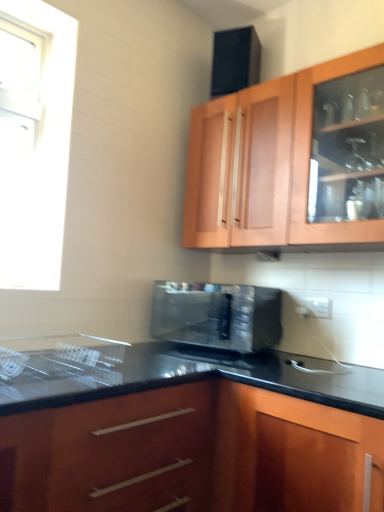
Question: Can you confirm if satin black microwave at center is thinner than glossy wood cabinet at lower center, the first cabinetry when ordered from bottom to top?

Choices:
 (A) no
 (B) yes

Answer: (B)

Question: Is satin black microwave at center at the left side of glossy wood cabinet at lower center, the first cabinetry when ordered from bottom to top?

Choices:
 (A) yes
 (B) no

Answer: (A)

Question: Considering the relative sizes of satin black microwave at center and glossy wood cabinet at lower center, the first cabinetry when ordered from bottom to top, in the image provided, is satin black microwave at center shorter than glossy wood cabinet at lower center, the first cabinetry when ordered from bottom to top,?

Choices:
 (A) yes
 (B) no

Answer: (A)

Question: Is the position of satin black microwave at center less distant than that of glossy wood cabinet at lower center, which is the 2th cabinetry from top to bottom?

Choices:
 (A) yes
 (B) no

Answer: (B)

Question: From a real-world perspective, does satin black microwave at center stand above glossy wood cabinet at lower center, which is the 2th cabinetry from top to bottom?

Choices:
 (A) yes
 (B) no

Answer: (A)

Question: Is glossy wood cabinet at lower center, which is the 2th cabinetry from top to bottom, in front of or behind satin black microwave at center in the image?

Choices:
 (A) front
 (B) behind

Answer: (A)

Question: From the image's perspective, is glossy wood cabinet at lower center, which is the 2th cabinetry from top to bottom, located above or below satin black microwave at center?

Choices:
 (A) above
 (B) below

Answer: (B)

Question: Considering the positions of glossy wood cabinet at lower center, the first cabinetry when ordered from bottom to top, and satin black microwave at center in the image, is glossy wood cabinet at lower center, the first cabinetry when ordered from bottom to top, taller or shorter than satin black microwave at center?

Choices:
 (A) short
 (B) tall

Answer: (B)

Question: Is glossy wood cabinet at lower center, which is the 2th cabinetry from top to bottom, inside the boundaries of satin black microwave at center, or outside?

Choices:
 (A) inside
 (B) outside

Answer: (B)

Question: In the image, is wooden cabinet at upper center, the first cabinetry when ordered from top to bottom, positioned in front of or behind white glossy window at upper left?

Choices:
 (A) front
 (B) behind

Answer: (A)

Question: In terms of height, does wooden cabinet at upper center, the first cabinetry when ordered from top to bottom, look taller or shorter compared to white glossy window at upper left?

Choices:
 (A) short
 (B) tall

Answer: (A)

Question: In the image, is wooden cabinet at upper center, acting as the 2th cabinetry starting from the bottom, on the left side or the right side of white glossy window at upper left?

Choices:
 (A) left
 (B) right

Answer: (B)

Question: Considering the positions of wooden cabinet at upper center, acting as the 2th cabinetry starting from the bottom, and white glossy window at upper left in the image, is wooden cabinet at upper center, acting as the 2th cabinetry starting from the bottom, bigger or smaller than white glossy window at upper left?

Choices:
 (A) small
 (B) big

Answer: (B)

Question: From the image's perspective, is glossy wood cabinet at lower center, which is the 2th cabinetry from top to bottom, positioned above or below wooden cabinet at upper center, the first cabinetry when ordered from top to bottom?

Choices:
 (A) above
 (B) below

Answer: (B)

Question: Considering the positions of point (352, 480) and point (339, 137), is point (352, 480) closer or farther from the camera than point (339, 137)?

Choices:
 (A) closer
 (B) farther

Answer: (A)